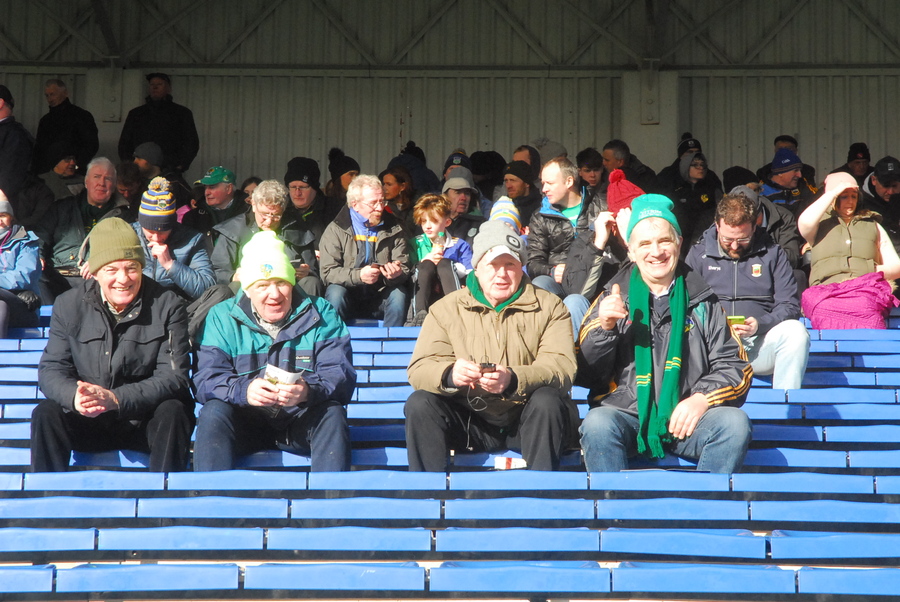
Where is `white wall`? Image resolution: width=900 pixels, height=602 pixels. white wall is located at coordinates (303, 99), (472, 129), (831, 137).